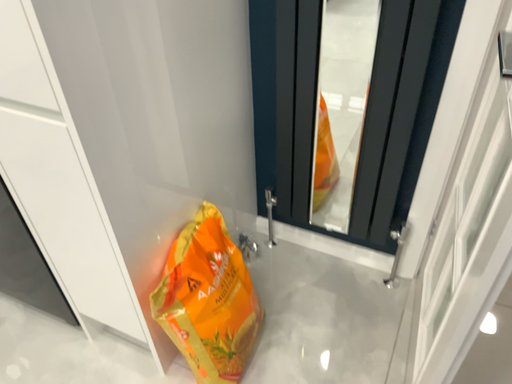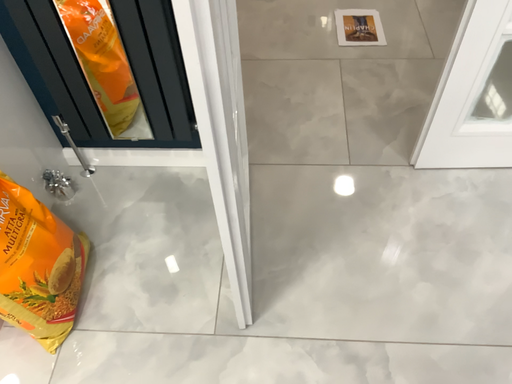
Question: How did the camera likely rotate when shooting the video?

Choices:
 (A) rotated left
 (B) rotated right

Answer: (B)